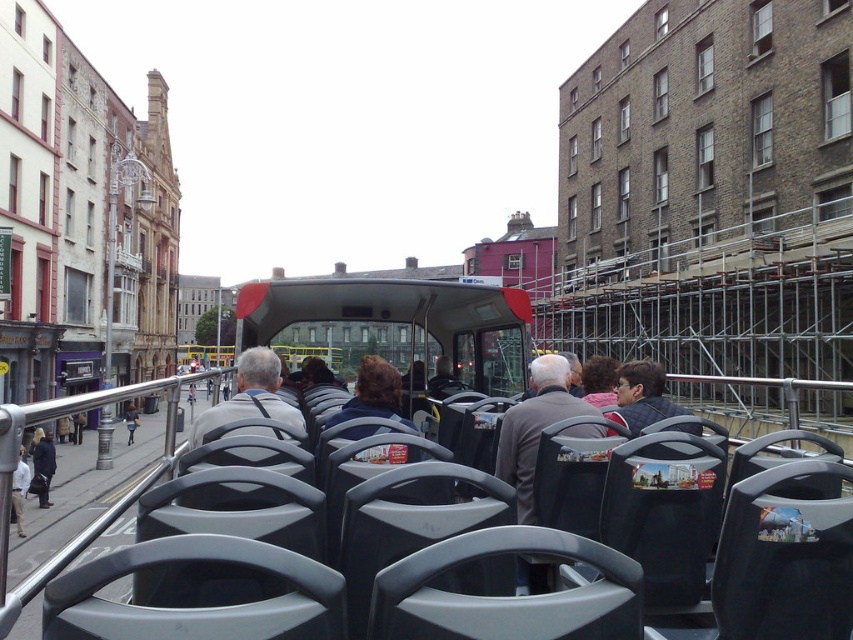
You are a passenger on an open top bus tour. You notice two jackets at the center of your view. The gray fabric jacket at center and the dark blue jacket at center. Which jacket is positioned higher relative to the other?

The gray fabric jacket at center is located above the dark blue jacket at center.

You are a tour guide standing on the open roof of the matte gray bus at center. You notice a passenger wearing a dark blue jacket at center. Can you see the top of their head while standing on the bus?

The matte gray bus at center is much taller than the dark blue jacket at center, so yes, you can see the top of their head from the bus roof.